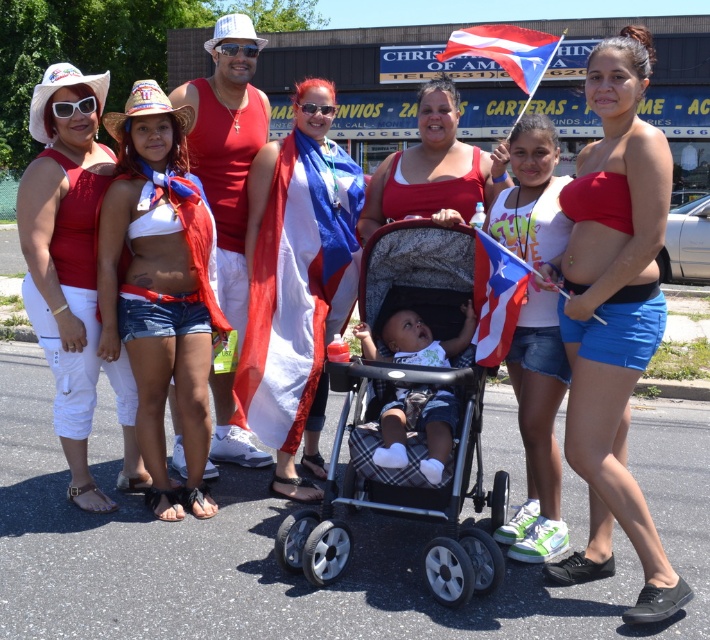
Question: Can you confirm if red-white-blue fabric flag at center is positioned to the left of red-white-blue fabric flag at upper center?

Choices:
 (A) yes
 (B) no

Answer: (A)

Question: Can you confirm if white denim shorts at center is bigger than red-white-blue fabric at center?

Choices:
 (A) no
 (B) yes

Answer: (A)

Question: Can you confirm if matte red tank top at left is wider than red-white-blue fabric flag at upper center?

Choices:
 (A) yes
 (B) no

Answer: (B)

Question: Which object is closer to the camera taking this photo?

Choices:
 (A) white denim shorts at center
 (B) red-white-blue fabric flag at center

Answer: (B)

Question: Estimate the real-world distances between objects in this image. Which object is closer to the light blue fabric stroller at center?

Choices:
 (A) red-white-blue fabric flag at center
 (B) red-white-blue fabric flag at upper center

Answer: (A)

Question: Which object is the farthest from the denim shorts at center?

Choices:
 (A) matte red flag at center
 (B) black plastic baby carriage at center
 (C) matte red bikini top at center
 (D) red-white-blue fabric at center

Answer: (D)